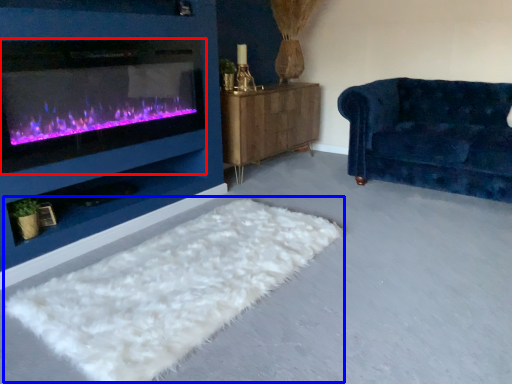
Question: Which object appears closest to the camera in this image, wood burning stove (highlighted by a red box) or mat (highlighted by a blue box)?

Choices:
 (A) wood burning stove
 (B) mat

Answer: (B)